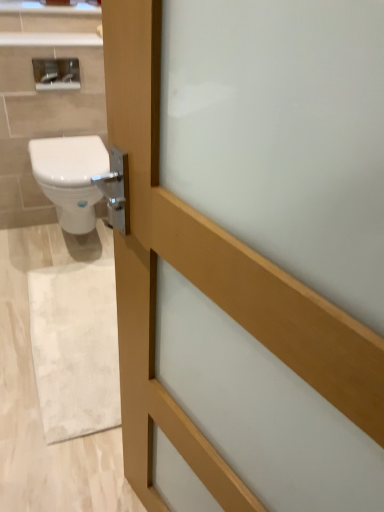
Locate an element on the screen. The width and height of the screenshot is (384, 512). white marble rug at lower left is located at coordinates tap(38, 398).

Find the location of `white marble rug at lower left`. white marble rug at lower left is located at coordinates (38, 398).

From the image's perspective, between satin silver mirror at upper left and white marble rug at lower left, which one is located above?

satin silver mirror at upper left, from the image's perspective.

Measure the distance from satin silver mirror at upper left to white marble rug at lower left.

satin silver mirror at upper left and white marble rug at lower left are 3.36 feet apart.

Can you confirm if satin silver mirror at upper left is thinner than white marble rug at lower left?

Indeed, satin silver mirror at upper left has a lesser width compared to white marble rug at lower left.

Which of these two, satin silver mirror at upper left or white marble rug at lower left, stands shorter?

With less height is white marble rug at lower left.

Can you tell me how much satin silver mirror at upper left and white glossy bidet at left differ in facing direction?

There is a 0.146-degree angle between the facing directions of satin silver mirror at upper left and white glossy bidet at left.

Considering the relative sizes of satin silver mirror at upper left and white glossy bidet at left in the image provided, is satin silver mirror at upper left wider than white glossy bidet at left?

No, satin silver mirror at upper left is not wider than white glossy bidet at left.

Is point (58, 76) in front of point (71, 197)?

That is False.

Based on the photo, from a real-world perspective, is white marble rug at lower left physically located above or below satin silver mirror at upper left?

From a real-world perspective, white marble rug at lower left is physically below satin silver mirror at upper left.

Considering the relative sizes of white marble rug at lower left and satin silver mirror at upper left in the image provided, is white marble rug at lower left wider than satin silver mirror at upper left?

Correct, the width of white marble rug at lower left exceeds that of satin silver mirror at upper left.

From the image's perspective, does white marble rug at lower left appear higher than satin silver mirror at upper left?

No, from the image's perspective, white marble rug at lower left is not over satin silver mirror at upper left.

How different are the orientations of white marble rug at lower left and satin silver mirror at upper left in degrees?

0.147 degrees.

Are white glossy bidet at left and white marble rug at lower left beside each other?

white glossy bidet at left is not next to white marble rug at lower left, and they're not touching.

From the image's perspective, is white glossy bidet at left on white marble rug at lower left?

Yes, from the image's perspective, white glossy bidet at left is over white marble rug at lower left.

Who is bigger, white glossy bidet at left or white marble rug at lower left?

white glossy bidet at left.

Is point (100, 139) closer to viewer compared to point (39, 483)?

No.

From a real-world perspective, relative to satin silver mirror at upper left, is white glossy bidet at left vertically above or below?

Clearly, from a real-world perspective, white glossy bidet at left is below satin silver mirror at upper left.

In the scene shown: Is white glossy bidet at left not within satin silver mirror at upper left?

Yes, white glossy bidet at left is not within satin silver mirror at upper left.

Is white glossy bidet at left looking in the opposite direction of satin silver mirror at upper left?

That's not correct — white glossy bidet at left is not looking away from satin silver mirror at upper left.

Between white glossy bidet at left and satin silver mirror at upper left, which one has larger size?

Bigger between the two is white glossy bidet at left.

From the image's perspective, which one is positioned lower, white marble rug at lower left or white glossy bidet at left?

Result: white marble rug at lower left.

In order to click on plain that appears in front of the white glossy bidet at left in this screenshot , I will do `click(38, 398)`.

Would you say white marble rug at lower left is outside white glossy bidet at left?

Yes, white marble rug at lower left is located beyond the bounds of white glossy bidet at left.

Relative to white glossy bidet at left, is white marble rug at lower left in front or behind?

white marble rug at lower left is positioned closer to the viewer than white glossy bidet at left.

Locate an element on the screen. The height and width of the screenshot is (512, 384). plain to the right of satin silver mirror at upper left is located at coordinates (38, 398).

The width and height of the screenshot is (384, 512). What are the coordinates of `bidet directly beneath the satin silver mirror at upper left (from a real-world perspective)` in the screenshot? It's located at (70, 177).

Looking at the image, which one is located further to white marble rug at lower left, white glossy bidet at left or satin silver mirror at upper left?

satin silver mirror at upper left is positioned further to the anchor white marble rug at lower left.

Looking at this image, estimate the real-world distances between objects in this image. Which object is closer to satin silver mirror at upper left, white glossy bidet at left or white marble rug at lower left?

white glossy bidet at left is closer to satin silver mirror at upper left.

Estimate the real-world distances between objects in this image. Which object is closer to satin silver mirror at upper left, white marble rug at lower left or white glossy bidet at left?

The object closer to satin silver mirror at upper left is white glossy bidet at left.

Looking at the image, which one is located closer to white glossy bidet at left, white marble rug at lower left or satin silver mirror at upper left?

satin silver mirror at upper left is closer to white glossy bidet at left.

Based on their spatial positions, is satin silver mirror at upper left or white marble rug at lower left further from white glossy bidet at left?

The object further to white glossy bidet at left is white marble rug at lower left.

Estimate the real-world distances between objects in this image. Which object is closer to white marble rug at lower left, satin silver mirror at upper left or white glossy bidet at left?

white glossy bidet at left lies closer to white marble rug at lower left than the other object.

Where is `bidet between satin silver mirror at upper left and white marble rug at lower left in the vertical direction`? bidet between satin silver mirror at upper left and white marble rug at lower left in the vertical direction is located at coordinates (70, 177).